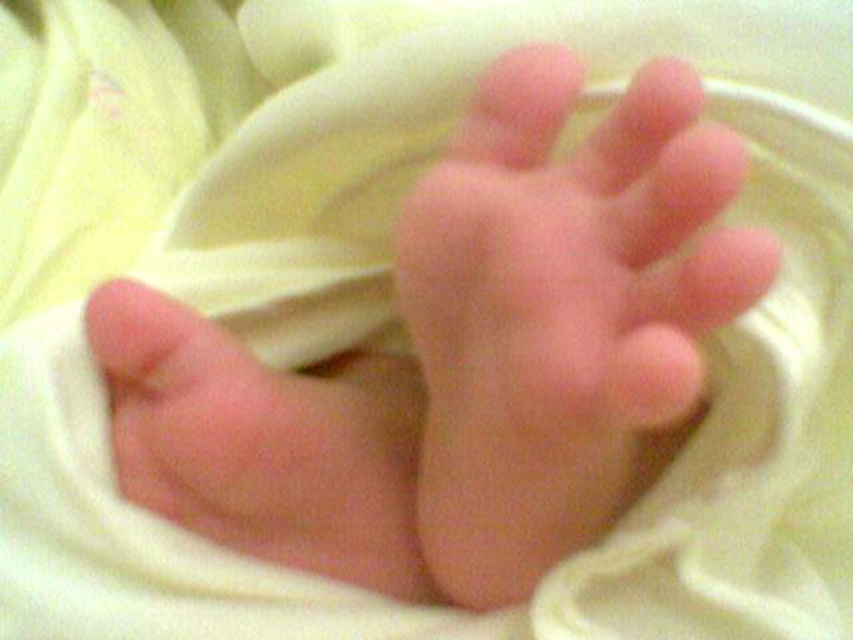
You are a nurse checking the baby in the image. You notice two areas of pink smooth skin at center and pink smooth skin at lower left. Which area is located above the other?

The pink smooth skin at center is positioned over the pink smooth skin at lower left, meaning the one at center is above the one at lower left.

You are a photographer capturing the newborn baby in the scene. You want to focus your camera on the pink smooth skin at center while ensuring the pink smooth skin at lower left is still visible but less prominent. Based on their positions, is this possible?

The pink smooth skin at center is in front of the pink smooth skin at lower left, so focusing on the pink smooth skin at center will naturally keep the pink smooth skin at lower left visible but slightly blurred and less prominent in the background.